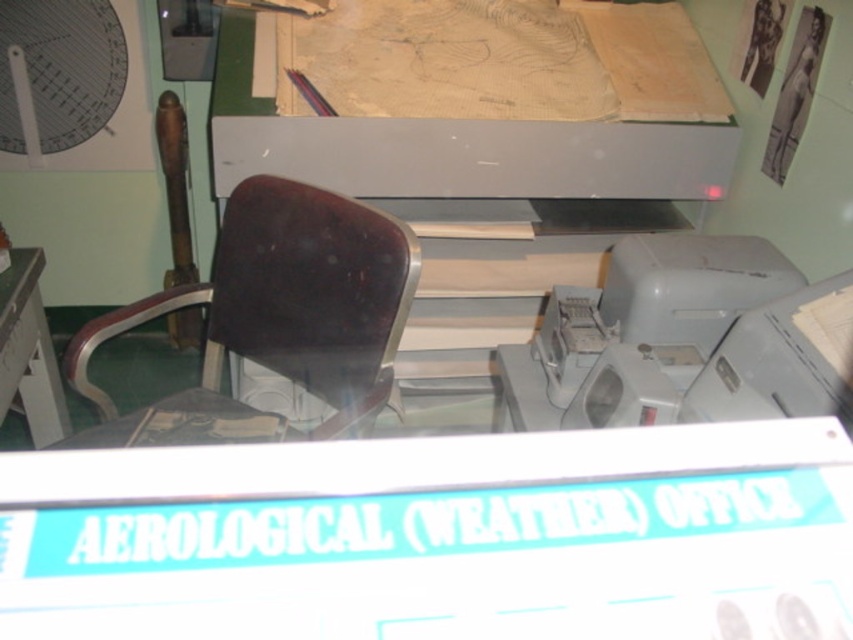
Based on the photo, you are an office worker in this historical weather office. You need to move a heavy box from the desk to the floor. The box is too large to fit through the space between the matte white mechanical fan at upper left and the white plastic table at left. Can you move the box around the fan or table instead?

The matte white mechanical fan at upper left is shorter than the white plastic table at left, so you can move the box around the fan since it is lower and less obstructive compared to the table.